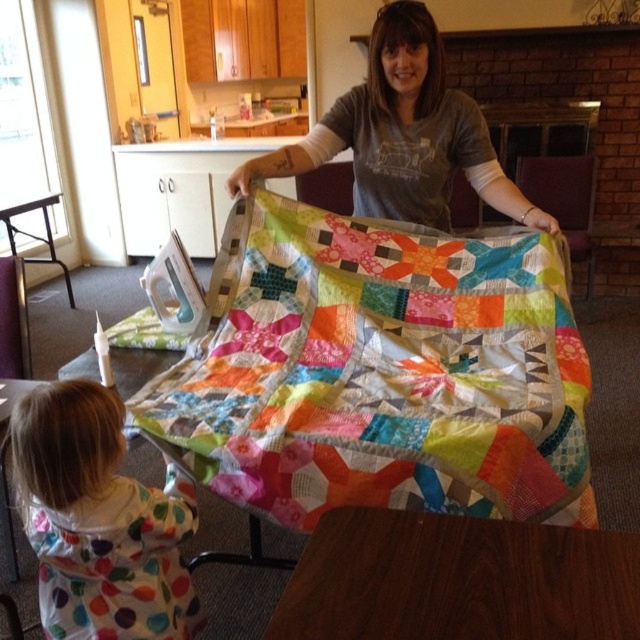
You are standing in the room and want to place a new quilt on the wooden table at center. According to the image, where exactly should you place it?

The wooden table at center is located at point 2D coordinates [458,580], so you should place the new quilt there.

You are a visitor in the room and want to place a small decorative item on the wooden table at center. However, you notice the matte gray shirt at center is currently on the table. Can the decorative item be placed on the table without moving the shirt?

The wooden table at center is not as tall as matte gray shirt at center, meaning the shirt is taller than the table. Since the shirt is on the table, it might block the surface, so placing the decorative item without moving the shirt may not be possible.